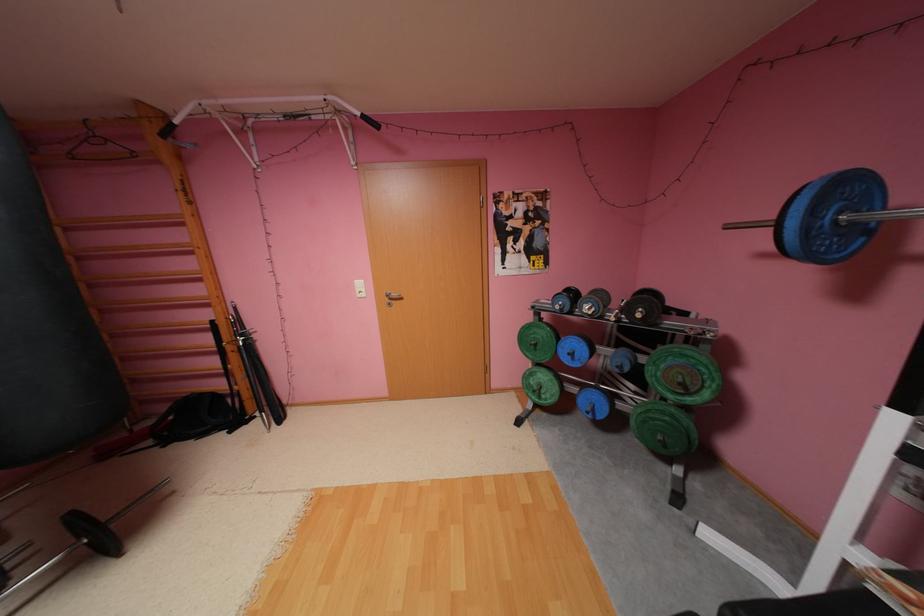
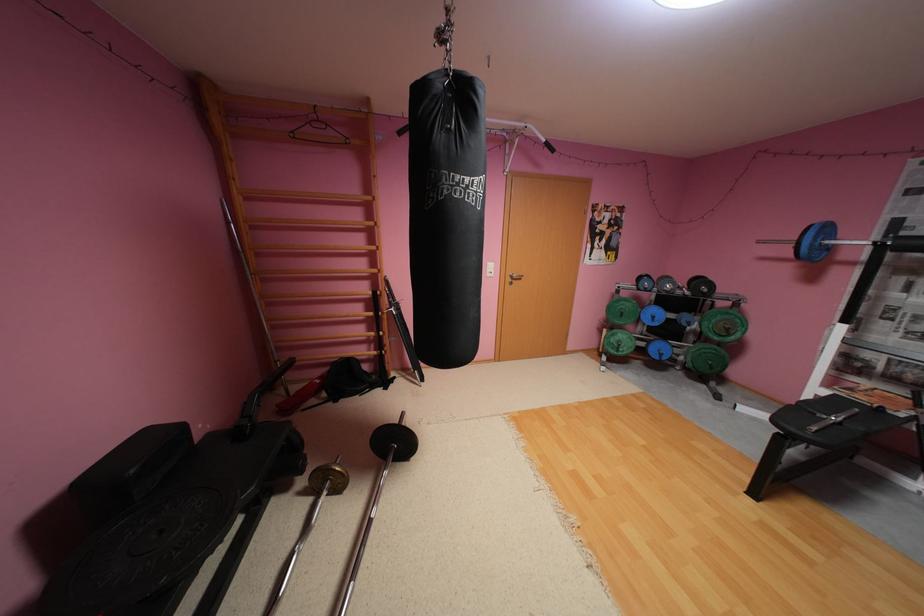
Locate, in the second image, the point that corresponds to (x=648, y=315) in the first image.

(714, 291)